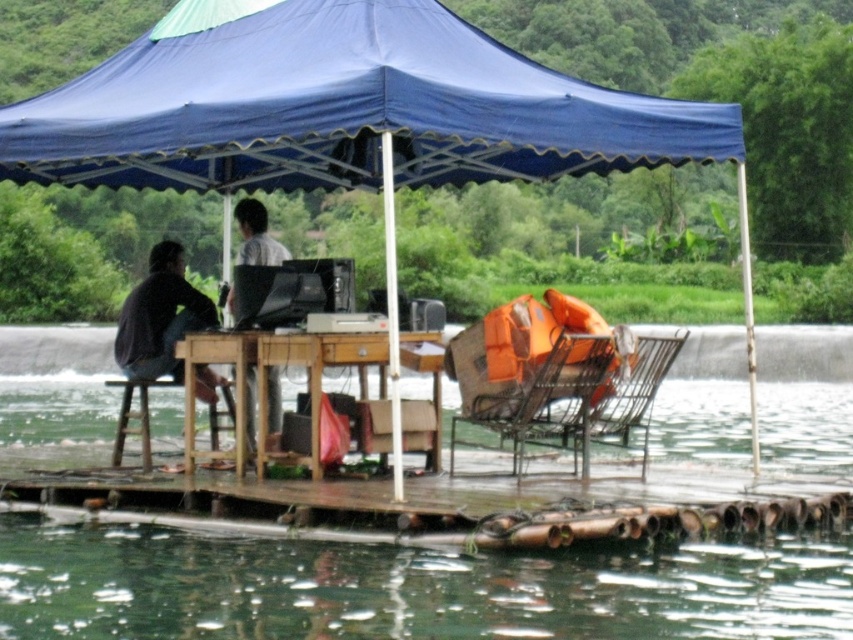
You are planning to set up a small solar panel on the floating platform. The solar panel requires a minimum height of 2 meters to avoid water splashes. Which object between the blue fabric tent at center and the wooden at lower center should you place the solar panel on to meet the height requirement?

The blue fabric tent at center has a greater height compared to wooden at lower center, so placing the solar panel on the blue fabric tent at center would meet the minimum height requirement of 2 meters.

You are a photographer trying to capture both the dark gray shirt at left and the light gray fabric shirt at center in a single frame. Which person should you position closer to the camera to ensure both fit within the shot?

Since the dark gray shirt at left is wider than the light gray fabric shirt at center, you should position the person in the dark gray shirt at left closer to the camera to ensure both fit within the shot.

You are planning to set up a small table under the blue fabric canopy at upper center and the metallic wire chair at center. Can you place the table directly under the canopy without it being obstructed by the chair?

The blue fabric canopy at upper center is above the metallic wire chair at center, so placing the table directly under the canopy would require positioning it around or behind the chair to avoid obstruction.